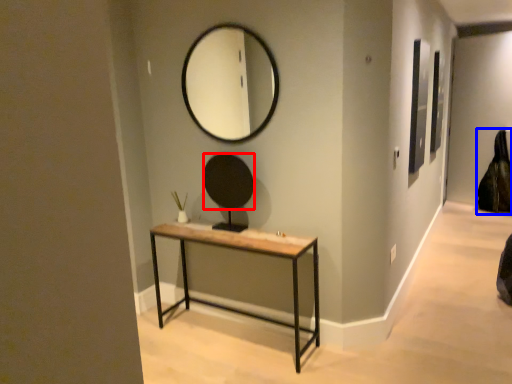
Question: Which point is further to the camera, mirror (highlighted by a red box) or swivel chair (highlighted by a blue box)?

Choices:
 (A) mirror
 (B) swivel chair

Answer: (B)